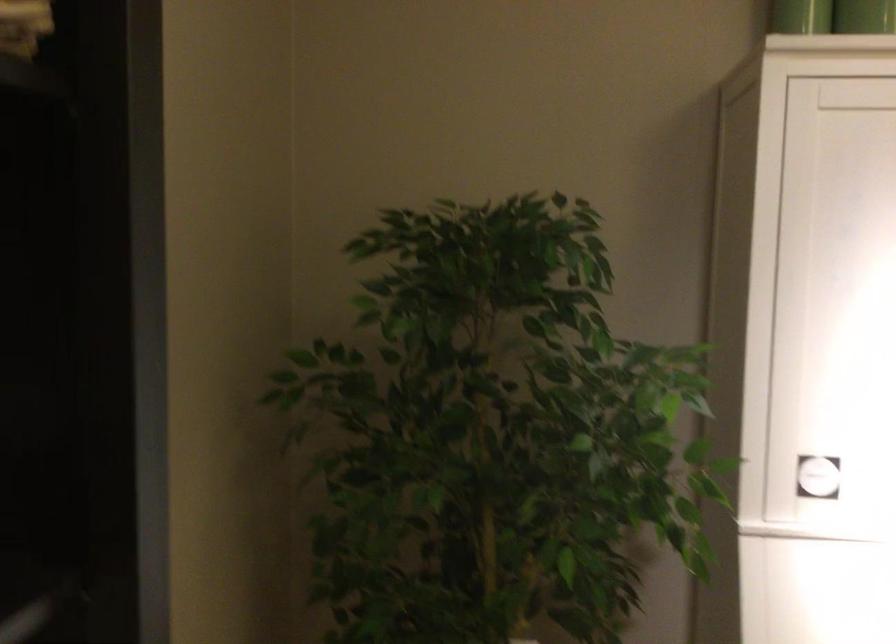
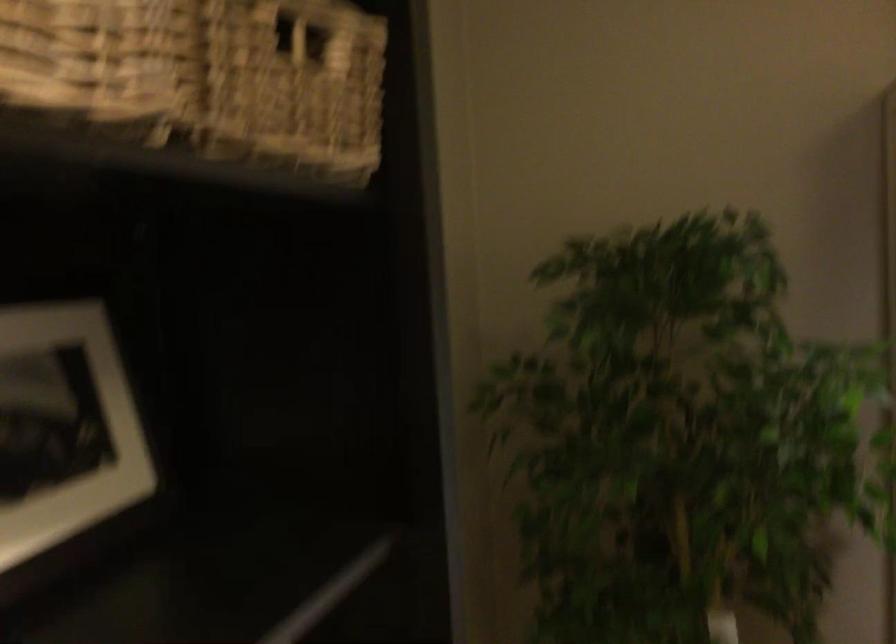
Question: What movement of the cameraman would produce the second image?

Choices:
 (A) Left
 (B) Right
 (C) Forward
 (D) Backward

Answer: (D)